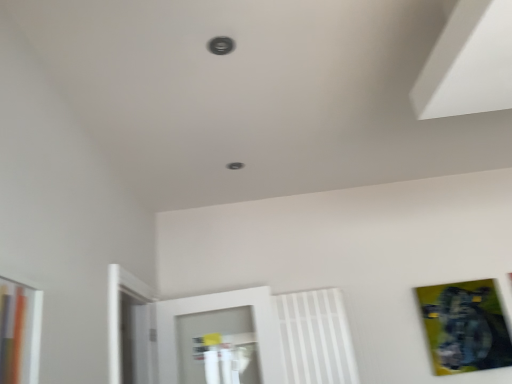
Question: Relative to metallic circular hole at center, which is counted as the first hole, starting from the back, is white plastic radiator at center in front or behind?

Choices:
 (A) behind
 (B) front

Answer: (A)

Question: From the image's perspective, relative to metallic circular hole at center, placed as the 1th hole when sorted from bottom to top, is white plastic radiator at center above or below?

Choices:
 (A) above
 (B) below

Answer: (B)

Question: Which object is the closest to the metallic gold picture frame at lower right?

Choices:
 (A) metallic circular hole at center, which is counted as the first hole, starting from the back
 (B) white plastic radiator at center
 (C) metallic circular hole at upper center, acting as the 1th hole starting from the front

Answer: (B)

Question: Which of these objects is positioned closest to the metallic circular hole at center, which is counted as the first hole, starting from the back?

Choices:
 (A) metallic gold picture frame at lower right
 (B) metallic circular hole at upper center, acting as the 1th hole starting from the front
 (C) white plastic radiator at center

Answer: (B)